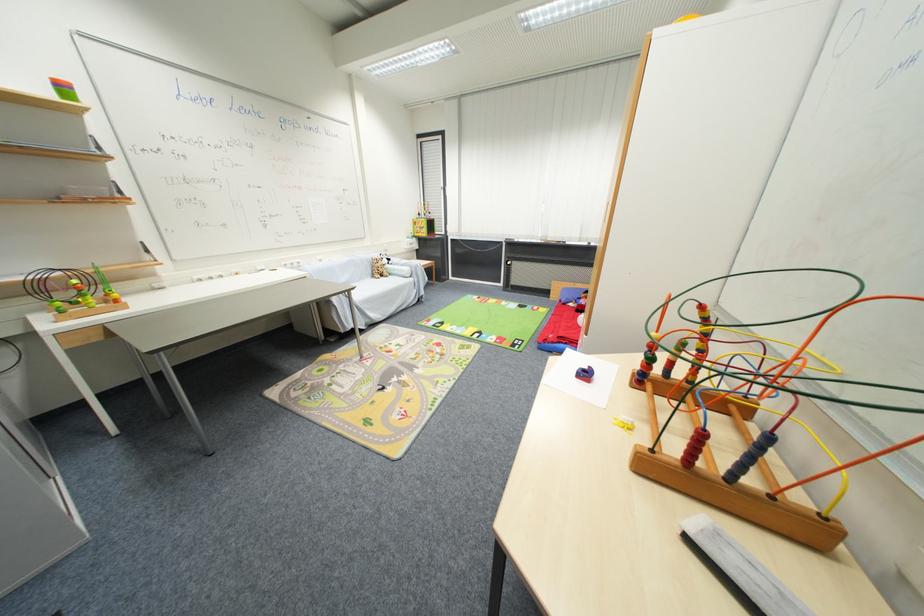
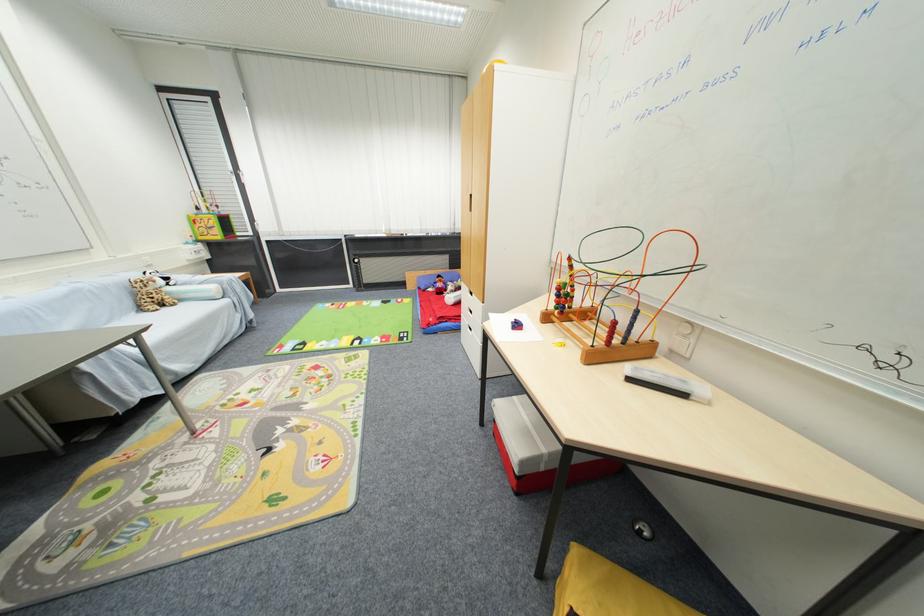
Find the pixel in the second image that matches (415,241) in the first image.

(198, 249)